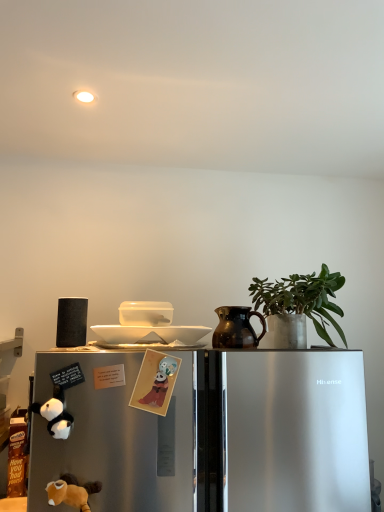
Question: Considering the relative positions of sleek metallic refrigerator at lower left and green matte plant at upper right in the image provided, is sleek metallic refrigerator at lower left in front of green matte plant at upper right?

Choices:
 (A) yes
 (B) no

Answer: (A)

Question: Considering the relative sizes of sleek metallic refrigerator at lower left and green matte plant at upper right in the image provided, is sleek metallic refrigerator at lower left shorter than green matte plant at upper right?

Choices:
 (A) yes
 (B) no

Answer: (B)

Question: Can you confirm if sleek metallic refrigerator at lower left is bigger than green matte plant at upper right?

Choices:
 (A) yes
 (B) no

Answer: (A)

Question: Considering the relative positions of sleek metallic refrigerator at lower left and green matte plant at upper right in the image provided, is sleek metallic refrigerator at lower left to the left of green matte plant at upper right from the viewer's perspective?

Choices:
 (A) yes
 (B) no

Answer: (A)

Question: Considering the relative positions of sleek metallic refrigerator at lower left and green matte plant at upper right in the image provided, is sleek metallic refrigerator at lower left behind green matte plant at upper right?

Choices:
 (A) yes
 (B) no

Answer: (B)

Question: Is sleek metallic refrigerator at lower left far from green matte plant at upper right?

Choices:
 (A) no
 (B) yes

Answer: (A)

Question: Is white glossy bowl at upper center, which appears as the first appliance when viewed from the right, surrounded by soft plush toy at lower left, which appears as the 2th animal when viewed from the left?

Choices:
 (A) yes
 (B) no

Answer: (B)

Question: Does soft plush toy at lower left, which appears as the 2th animal when viewed from the left, have a greater height compared to white glossy bowl at upper center, the second appliance when ordered from left to right?

Choices:
 (A) yes
 (B) no

Answer: (A)

Question: Does soft plush toy at lower left, the 1th animal from the bottom, turn towards white glossy bowl at upper center, the second appliance when ordered from left to right?

Choices:
 (A) yes
 (B) no

Answer: (B)

Question: Considering the relative sizes of soft plush toy at lower left, the 2th animal when ordered from right to left, and white glossy bowl at upper center, which appears as the first appliance when viewed from the right, in the image provided, is soft plush toy at lower left, the 2th animal when ordered from right to left, smaller than white glossy bowl at upper center, which appears as the first appliance when viewed from the right,?

Choices:
 (A) yes
 (B) no

Answer: (B)

Question: From a real-world perspective, does soft plush toy at lower left, which appears as the 2th animal when viewed from the left, stand above white glossy bowl at upper center, which appears as the first appliance when viewed from the right?

Choices:
 (A) no
 (B) yes

Answer: (A)

Question: Is soft plush toy at lower left, which appears as the 2th animal when viewed from the left, at the left side of white glossy bowl at upper center, which appears as the first appliance when viewed from the right?

Choices:
 (A) no
 (B) yes

Answer: (B)

Question: Is sleek metallic refrigerator at lower left positioned behind black matte speaker at left, the 1th appliance in the left-to-right sequence?

Choices:
 (A) no
 (B) yes

Answer: (A)